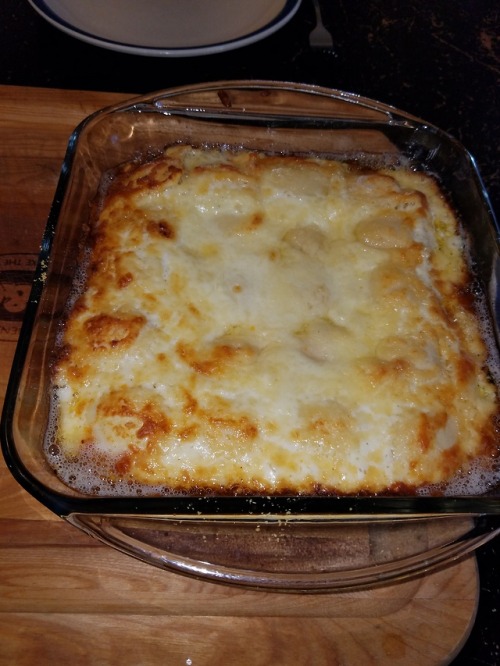
The height and width of the screenshot is (666, 500). What are the coordinates of `dish` in the screenshot? It's located at (46, 492).